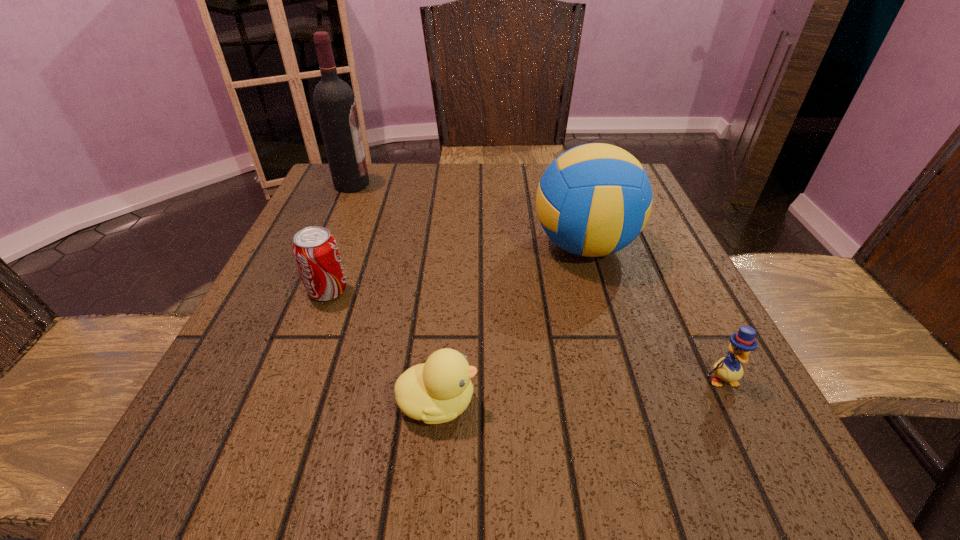
The image size is (960, 540). I want to click on free space that is in between the soda and the tallest object, so click(340, 238).

Locate an element on the screen. The height and width of the screenshot is (540, 960). unoccupied position between the soda and the fourth shortest object is located at coordinates (456, 268).

I want to click on free space between the second object from right to left and the tallest object, so click(468, 215).

Find the location of `vacant area that lies between the rightmost object and the fourth shortest object`. vacant area that lies between the rightmost object and the fourth shortest object is located at coordinates (653, 313).

Where is `object that stands as the fourth closest to the second tallest object`? object that stands as the fourth closest to the second tallest object is located at coordinates (334, 100).

Locate an element on the screen. This screenshot has height=540, width=960. object that is the second nearest to the second tallest object is located at coordinates (437, 391).

Locate an element on the screen. The image size is (960, 540). blank area in the image that satisfies the following two spatial constraints: 1. on the label of the volleyball; 2. on the right side of the wine bottle is located at coordinates (325, 246).

At what (x,y) coordinates should I click in order to perform the action: click on free spot that satisfies the following two spatial constraints: 1. on the face of the right duckling, where the monocle is placed; 2. at the beak of the left duckling. Please return your answer as a coordinate pair (x, y). Looking at the image, I should click on (732, 402).

Where is `blank space that satisfies the following two spatial constraints: 1. on the label of the wine bottle; 2. on the left side of the soda`? The image size is (960, 540). blank space that satisfies the following two spatial constraints: 1. on the label of the wine bottle; 2. on the left side of the soda is located at coordinates (305, 291).

Locate an element on the screen. This screenshot has width=960, height=540. vacant space that satisfies the following two spatial constraints: 1. on the face of the right duckling, where the monocle is placed; 2. at the beak of the left duckling is located at coordinates (732, 402).